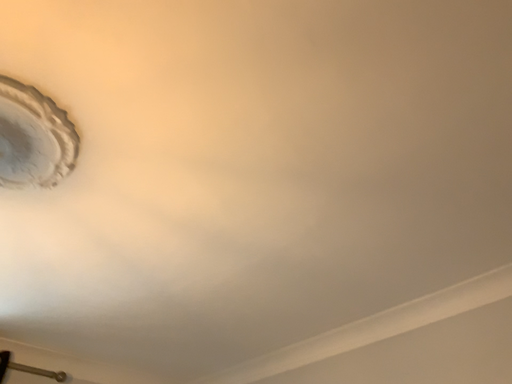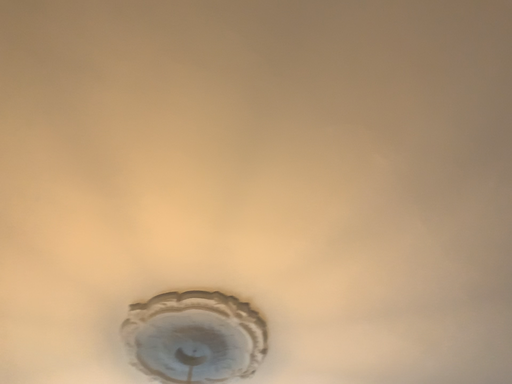
Question: How did the camera likely rotate when shooting the video?

Choices:
 (A) rotated downward
 (B) rotated upward

Answer: (B)